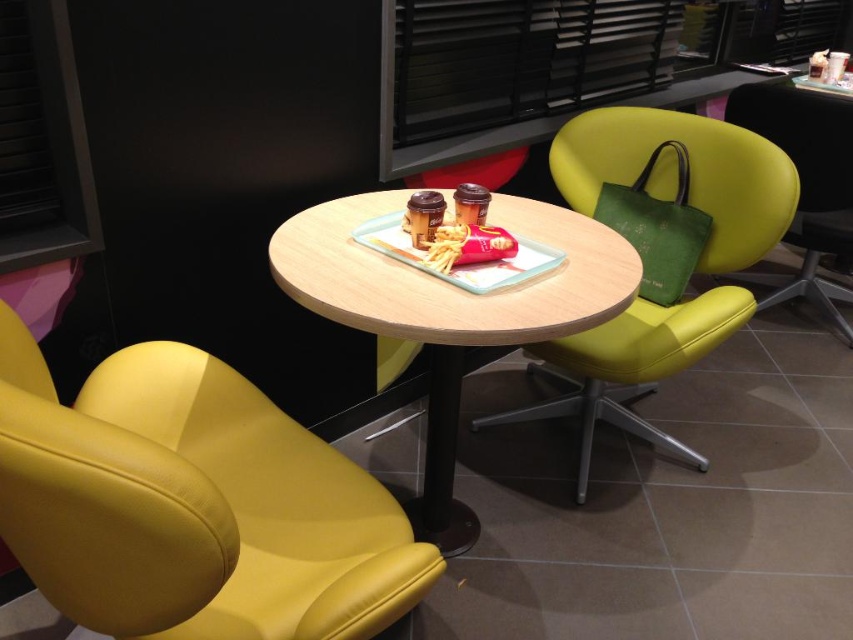
Question: Which of the following is the closest to the observer?

Choices:
 (A) yellow leather swivel chair at lower left
 (B) green leather chair at upper right
 (C) matte yellow swivel chair at center

Answer: (A)

Question: Which point appears farthest from the camera in this image?

Choices:
 (A) (373, 209)
 (B) (199, 608)

Answer: (A)

Question: Can you confirm if yellow leather swivel chair at lower left is positioned to the left of green leather chair at upper right?

Choices:
 (A) yes
 (B) no

Answer: (A)

Question: From the image, what is the correct spatial relationship of wooden round table at center in relation to green leather chair at upper right?

Choices:
 (A) left
 (B) right

Answer: (A)

Question: Among these objects, which one is nearest to the camera?

Choices:
 (A) green leather chair at upper right
 (B) matte yellow swivel chair at center
 (C) yellow leather swivel chair at lower left
 (D) wooden round table at center

Answer: (C)

Question: Can you confirm if wooden round table at center is positioned above green leather chair at upper right?

Choices:
 (A) no
 (B) yes

Answer: (A)